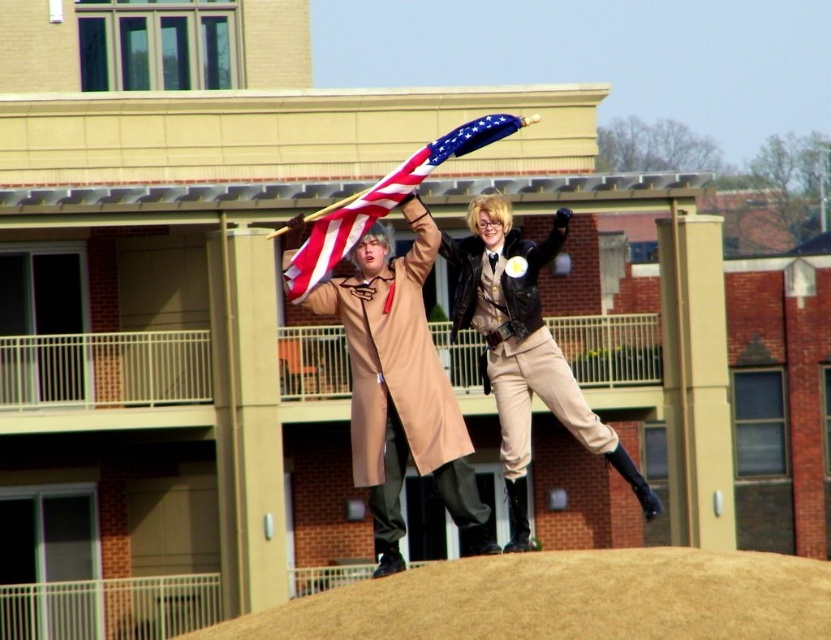
Question: Does brown textured mound at lower center appear on the right side of tan leather coat at center?

Choices:
 (A) yes
 (B) no

Answer: (A)

Question: Which point is farther to the camera?

Choices:
 (A) (330, 252)
 (B) (318, 291)
 (C) (504, 445)

Answer: (B)

Question: Is tan leather coat at center below american flag at center?

Choices:
 (A) yes
 (B) no

Answer: (A)

Question: Which point is farther from the camera taking this photo?

Choices:
 (A) (423, 461)
 (B) (495, 577)

Answer: (A)

Question: Among these objects, which one is farthest from the camera?

Choices:
 (A) tan leather coat at center
 (B) american flag at center
 (C) brown textured mound at lower center
 (D) tan leather trench coat at center

Answer: (A)

Question: Does brown textured mound at lower center have a smaller size compared to tan leather trench coat at center?

Choices:
 (A) no
 (B) yes

Answer: (B)